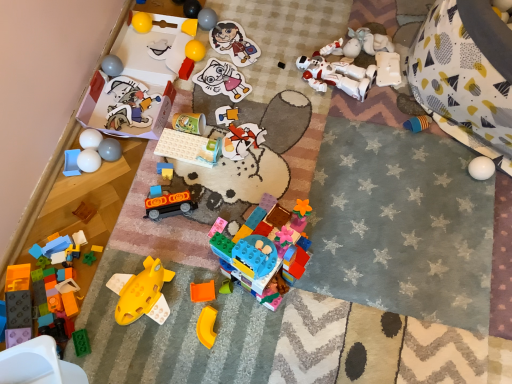
You are a GUI agent. You are given a task and a screenshot of the screen. Output one action in this format:
    pyautogui.click(x=<x>, y=<y>)
    Task: Click on the free space in front of translucent orange plastic at center, arranged as the nineteenth toy when viewed from the left
    
    Given the screenshot: What is the action you would take?
    pyautogui.click(x=222, y=345)